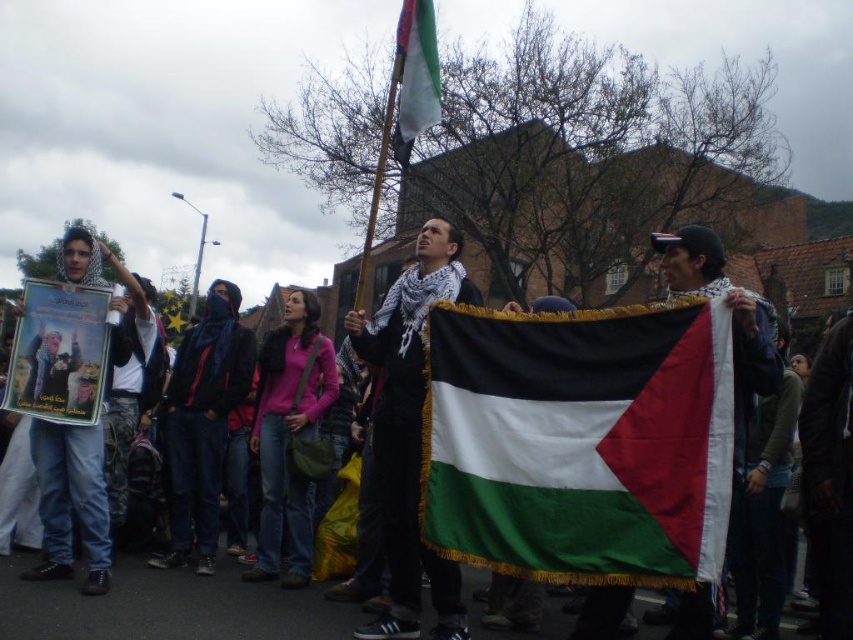
Question: Can you confirm if white textured scarf at center is positioned to the left of matte black scarf at center?

Choices:
 (A) yes
 (B) no

Answer: (A)

Question: Which point is closer to the camera?

Choices:
 (A) (685, 236)
 (B) (618, 518)
 (C) (415, 321)

Answer: (B)

Question: Is matte black scarf at center positioned at the back of white fabric flag at upper center?

Choices:
 (A) yes
 (B) no

Answer: (B)

Question: Which point is farther to the camera?

Choices:
 (A) white fabric flag at upper center
 (B) white textured scarf at center
 (C) matte black scarf at center

Answer: (A)

Question: Estimate the real-world distances between objects in this image. Which object is farther from the white fabric flag at upper center?

Choices:
 (A) matte black scarf at center
 (B) white textured scarf at center

Answer: (A)

Question: Is white textured scarf at center to the right of matte black scarf at center from the viewer's perspective?

Choices:
 (A) yes
 (B) no

Answer: (B)